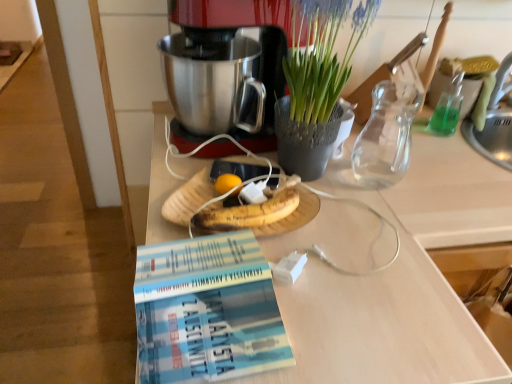
Identify the location of vacant area that lies to the right of blue paperback book at lower center. The height and width of the screenshot is (384, 512). (359, 327).